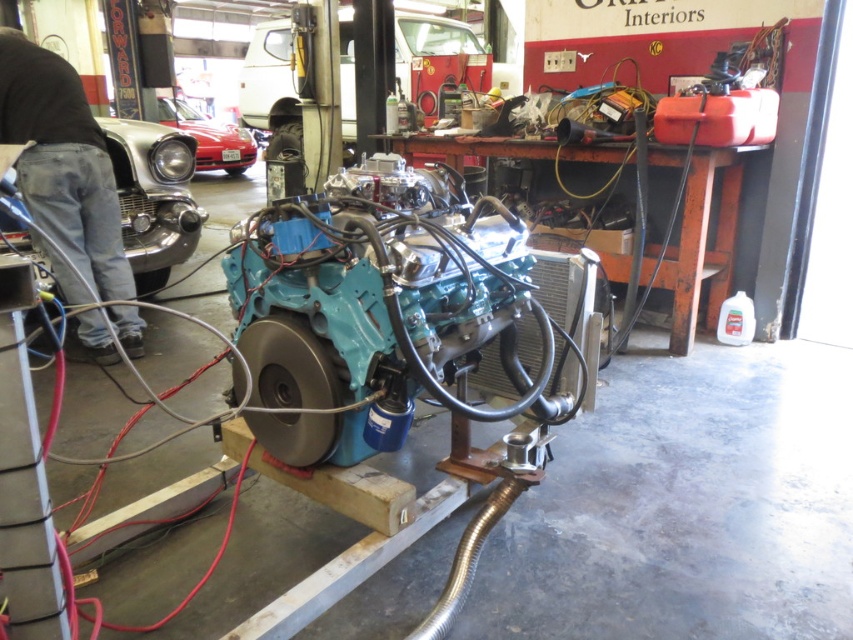
Is shiny silver car at left positioned before shiny red car at center?

That is True.

Which is more to the left, shiny silver car at left or shiny red car at center?

shiny red car at center is more to the left.

You are a GUI agent. You are given a task and a screenshot of the screen. Output one action in this format:
    pyautogui.click(x=<x>, y=<y>)
    Task: Click on the shiny silver car at left
    This screenshot has width=853, height=640.
    Given the screenshot: What is the action you would take?
    pyautogui.click(x=154, y=196)

Is metallic silver car at upper center above shiny red car at center?

Indeed, metallic silver car at upper center is positioned over shiny red car at center.

Which is more to the left, metallic silver car at upper center or shiny red car at center?

From the viewer's perspective, shiny red car at center appears more on the left side.

Identify the location of metallic silver car at upper center. (437, 60).

Does point (74, 296) come farther from viewer compared to point (485, 64)?

No.

Does denim jeans at left have a larger size compared to metallic silver car at upper center?

Incorrect, denim jeans at left is not larger than metallic silver car at upper center.

Between point (41, 74) and point (410, 24), which one is positioned behind?

Point (410, 24)

The width and height of the screenshot is (853, 640). I want to click on denim jeans at left, so click(62, 163).